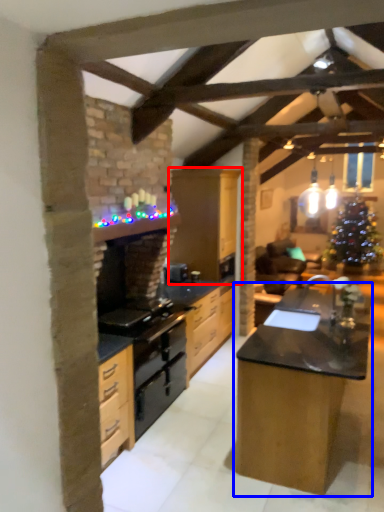
Question: Which object appears farthest to the camera in this image, cabinetry (highlighted by a red box) or table (highlighted by a blue box)?

Choices:
 (A) cabinetry
 (B) table

Answer: (A)